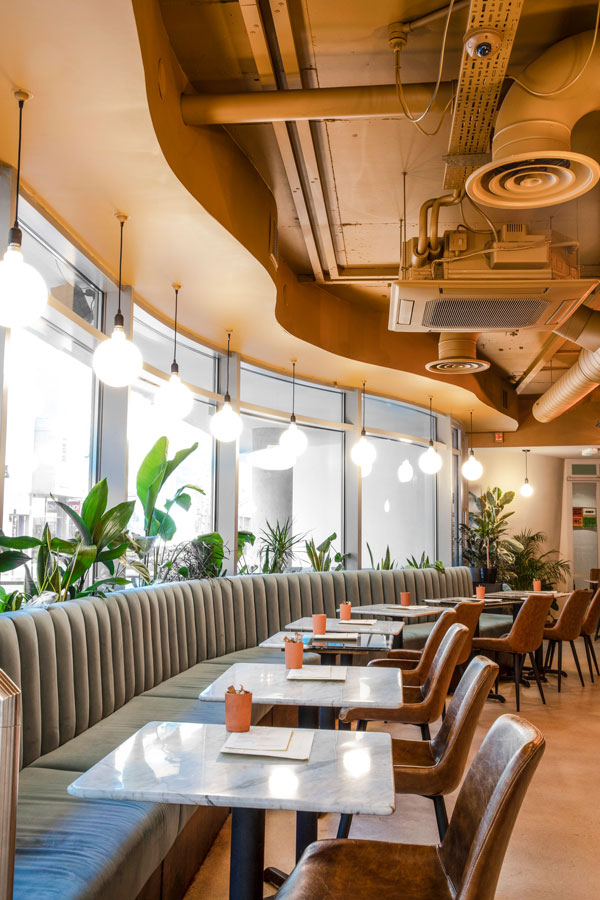
Identify the location of curved window panes. Image resolution: width=600 pixels, height=900 pixels. (49, 446), (182, 432), (270, 489), (400, 501), (453, 523), (69, 288), (196, 367), (267, 396), (395, 419), (454, 442).